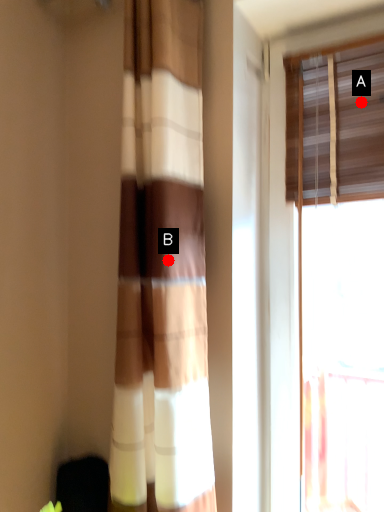
Question: Two points are circled on the image, labeled by A and B beside each circle. Which point is further to the camera?

Choices:
 (A) A is further
 (B) B is further

Answer: (A)